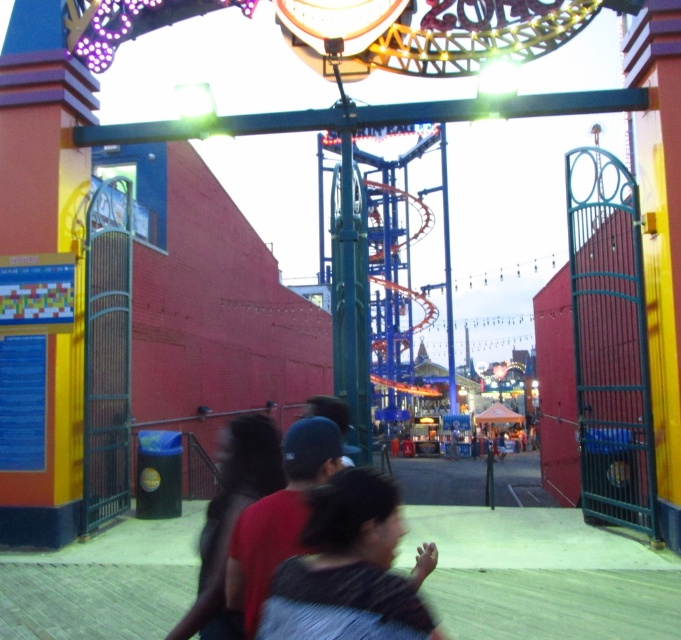
Is blurred dark hair at center to the right of dark gray fabric shirt at center from the viewer's perspective?

Yes, blurred dark hair at center is to the right of dark gray fabric shirt at center.

Does blurred dark hair at center appear on the left side of dark gray fabric shirt at center?

Incorrect, blurred dark hair at center is not on the left side of dark gray fabric shirt at center.

What do you see at coordinates (349, 570) in the screenshot?
I see `blurred dark hair at center` at bounding box center [349, 570].

Identify the location of blurred dark hair at center. The width and height of the screenshot is (681, 640). click(x=349, y=570).